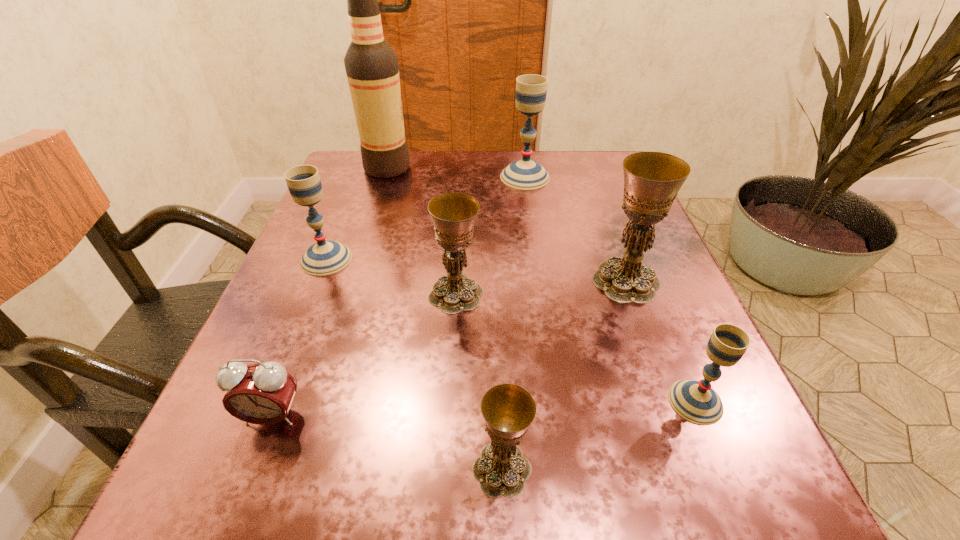
This screenshot has height=540, width=960. What are the coordinates of `vacant space at the near edge of the desktop` in the screenshot? It's located at (561, 476).

At what (x,y) coordinates should I click in order to perform the action: click on vacant space at the left edge of the desktop. Please return your answer as a coordinate pair (x, y). This screenshot has height=540, width=960. Looking at the image, I should click on (311, 321).

Identify the location of free space at the right edge of the desktop. Image resolution: width=960 pixels, height=540 pixels. (692, 360).

This screenshot has width=960, height=540. I want to click on vacant space at the far left corner of the desktop, so click(x=338, y=163).

Locate an element on the screen. The width and height of the screenshot is (960, 540). vacant space at the near left corner of the desktop is located at coordinates (262, 499).

Find the location of a particular element. The height and width of the screenshot is (540, 960). vacant region at the far right corner of the desktop is located at coordinates (608, 159).

Locate an element on the screen. blank region between the rightmost gold chalice and the nearest object is located at coordinates (564, 375).

The image size is (960, 540). In order to click on blank region between the nearest object and the alarm clock in this screenshot , I will do `click(387, 443)`.

The height and width of the screenshot is (540, 960). I want to click on free space between the second smallest gold chalice and the nearest object, so click(x=479, y=382).

The width and height of the screenshot is (960, 540). In order to click on vacant space in between the leftmost chalice and the smallest gold chalice in this screenshot , I will do `click(414, 364)`.